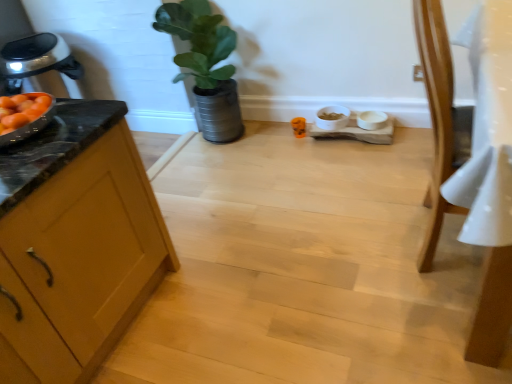
Question: Relative to wooden cabinet at left, is green matte plant at upper center in front or behind?

Choices:
 (A) behind
 (B) front

Answer: (A)

Question: Considering the positions of point (161, 13) and point (52, 150), is point (161, 13) closer or farther from the camera than point (52, 150)?

Choices:
 (A) closer
 (B) farther

Answer: (B)

Question: Which object is positioned closest to the light brown wooden chair at right?

Choices:
 (A) wooden cabinet at left
 (B) green matte plant at upper center

Answer: (A)

Question: Which object is the closest to the light brown wooden chair at right?

Choices:
 (A) wooden cabinet at left
 (B) green matte plant at upper center

Answer: (A)